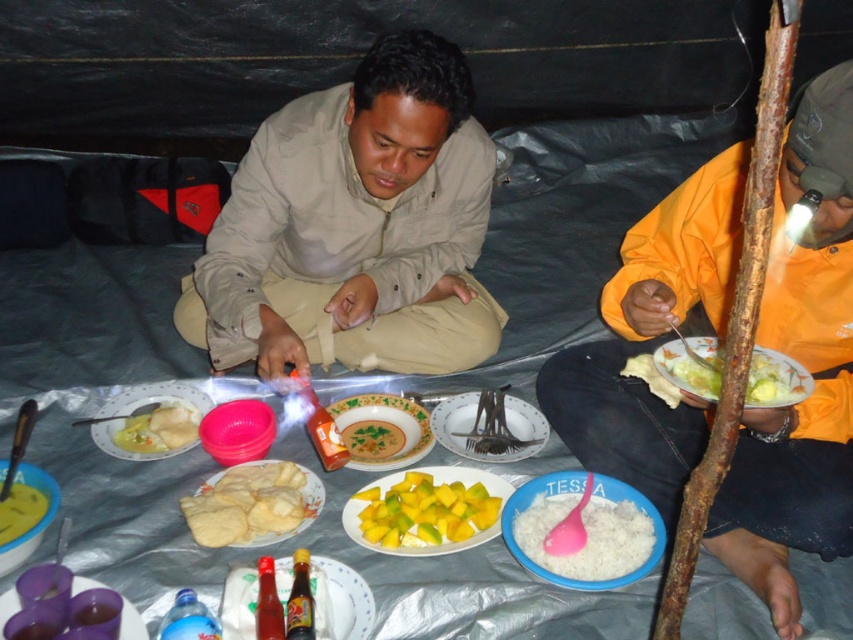
Question: Is matte plastic plate at center positioned before smooth yellowish rice at center?

Choices:
 (A) no
 (B) yes

Answer: (B)

Question: Which object is farther from the camera taking this photo?

Choices:
 (A) white glossy plate at lower right
 (B) orange fabric jacket at upper right
 (C) golden fried pastry at center
 (D) white plastic table at center

Answer: (C)

Question: Can you confirm if matte plastic plate at center is thinner than white matte plate at center?

Choices:
 (A) no
 (B) yes

Answer: (B)

Question: Which of the following is the farthest from the observer?

Choices:
 (A) (109, 404)
 (B) (346, 508)
 (C) (474, 460)

Answer: (A)

Question: Which of the following is the farthest from the observer?

Choices:
 (A) beige cotton shirt at center
 (B) white glossy plate at lower right

Answer: (A)

Question: Is matte white plate at center left bigger than white matte bread at center?

Choices:
 (A) no
 (B) yes

Answer: (B)